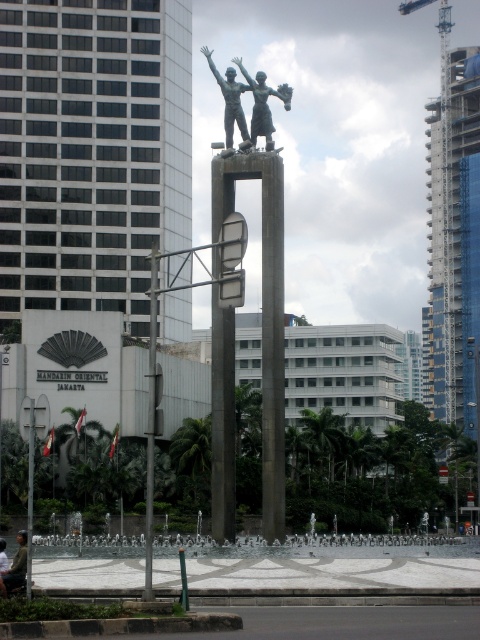
Question: Which of the following is the closest to the observer?

Choices:
 (A) (227, 90)
 (B) (479, 243)

Answer: (A)

Question: Which point is farther from the camera taking this photo?

Choices:
 (A) (104, 67)
 (B) (445, 109)
 (C) (252, 81)
 (D) (230, 124)

Answer: (B)

Question: Can you confirm if white marble fountain at center is positioned to the right of dark brown leather jacket at lower left?

Choices:
 (A) no
 (B) yes

Answer: (B)

Question: Does polished bronze statue at center appear over dark brown leather jacket at lower left?

Choices:
 (A) no
 (B) yes

Answer: (B)

Question: Does white marble fountain at center appear on the left side of metallic pole at center?

Choices:
 (A) no
 (B) yes

Answer: (A)

Question: Based on their relative distances, which object is farther from the glass windows at left?

Choices:
 (A) polished bronze statue at center
 (B) white marble fountain at center
 (C) glassy blue skyscraper at right

Answer: (B)